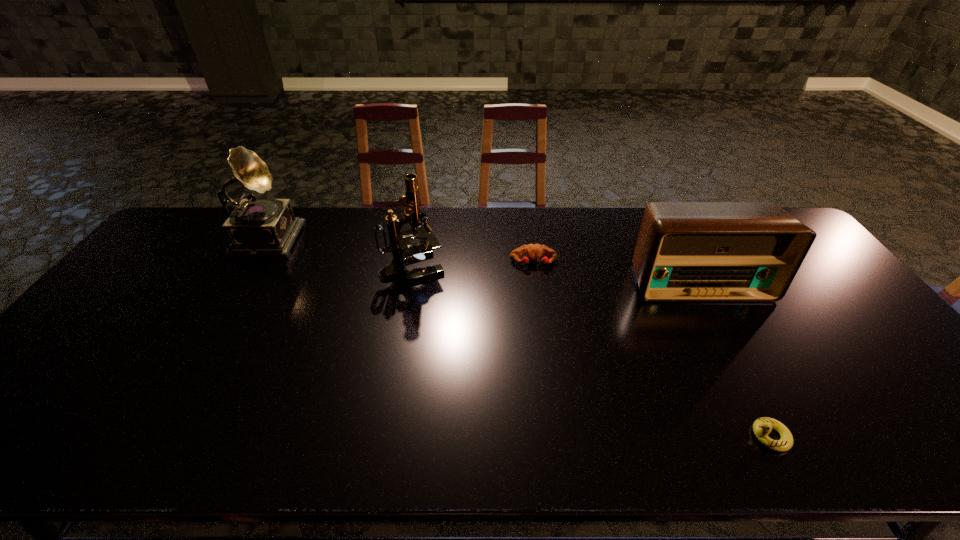
In order to click on free space between the puncher and the duckling in this screenshot , I will do `click(652, 349)`.

At what (x,y) coordinates should I click in order to perform the action: click on empty location between the record player and the microscope. Please return your answer as a coordinate pair (x, y). The width and height of the screenshot is (960, 540). Looking at the image, I should click on (341, 251).

Identify the location of empty space that is in between the third shortest object and the leftmost object. (484, 258).

Find the location of `empty space that is in between the fourth object from right to left and the third shortest object`. empty space that is in between the fourth object from right to left and the third shortest object is located at coordinates (556, 274).

Image resolution: width=960 pixels, height=540 pixels. What are the coordinates of `free space between the radio receiver and the duckling` in the screenshot? It's located at (734, 359).

The image size is (960, 540). Identify the location of vacant region between the second object from left to right and the nearest object. (591, 351).

What are the coordinates of `vacant area that lies between the microscope and the puncher` in the screenshot? It's located at (473, 265).

What are the coordinates of `vacant area that lies between the radio receiver and the nearest object` in the screenshot? It's located at (734, 359).

Where is `object that is the third nearest to the nearest object`? The width and height of the screenshot is (960, 540). object that is the third nearest to the nearest object is located at coordinates (403, 250).

Select which object is the closest to the second object from left to right. Please provide its 2D coordinates. Your answer should be formatted as a tuple, i.e. [(x, y)], where the tuple contains the x and y coordinates of a point satisfying the conditions above.

[(533, 251)]